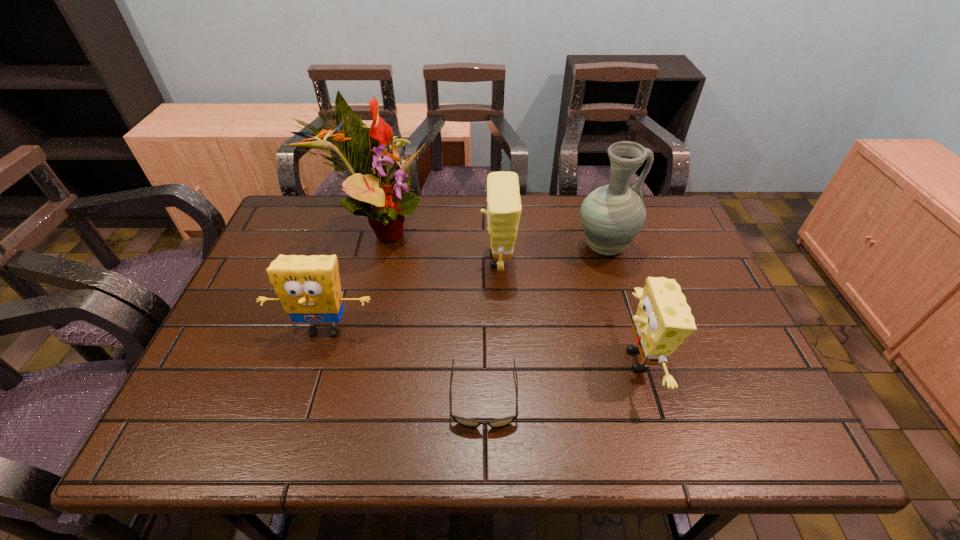
The width and height of the screenshot is (960, 540). What are the coordinates of `the tallest object` in the screenshot? It's located at (367, 153).

The height and width of the screenshot is (540, 960). Find the location of `pitcher`. pitcher is located at coordinates (612, 215).

At what (x,y) coordinates should I click in order to perform the action: click on the second sponge from right to left. Please return your answer as a coordinate pair (x, y). The height and width of the screenshot is (540, 960). Looking at the image, I should click on (504, 207).

Identify the location of the leftmost sponge. The width and height of the screenshot is (960, 540). (309, 288).

Where is `the rightmost sponge`? The image size is (960, 540). the rightmost sponge is located at coordinates (663, 320).

At what (x,y) coordinates should I click in order to perform the action: click on the shortest object. Please return your answer as a coordinate pair (x, y). Looking at the image, I should click on [x=467, y=422].

At what (x,y) coordinates should I click in order to perform the action: click on vacant space located 0.180m on the front-facing side of the bouquet. Please return your answer as a coordinate pair (x, y). The image size is (960, 540). Looking at the image, I should click on (489, 230).

Identify the location of vacant space located 0.160m on the handle side of the fifth shortest object. click(x=688, y=247).

Locate an element on the screen. vacant space located on the face of the farthest sponge is located at coordinates (365, 260).

Locate an element on the screen. The width and height of the screenshot is (960, 540). free space located on the face of the farthest sponge is located at coordinates (369, 260).